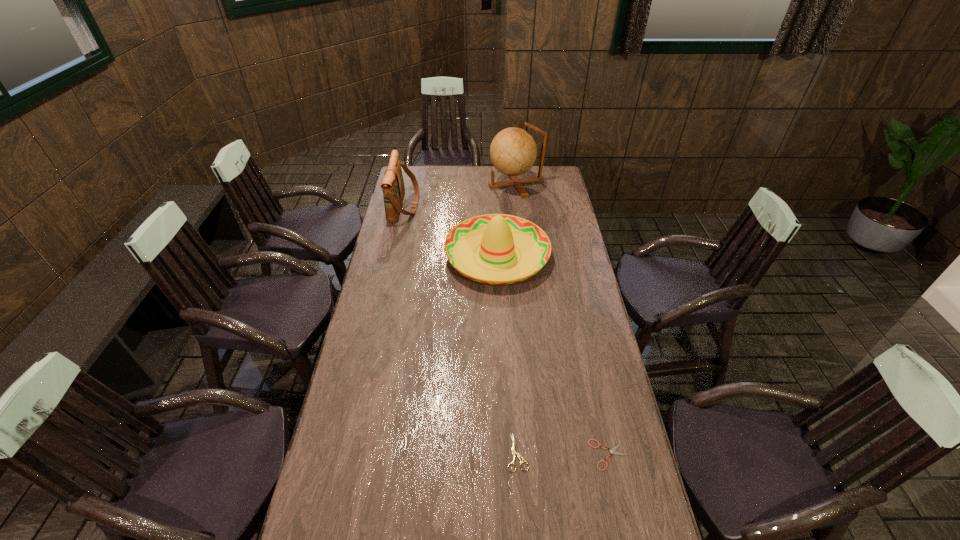
Locate an element on the screen. Image resolution: width=960 pixels, height=540 pixels. object that is at the far left corner is located at coordinates (392, 184).

Identify the location of object located in the far right corner section of the desktop. (513, 151).

The width and height of the screenshot is (960, 540). What are the coordinates of `vacant space at the far edge of the desktop` in the screenshot? It's located at (445, 171).

At what (x,y) coordinates should I click in order to perform the action: click on free space at the left edge of the desktop. Please return your answer as a coordinate pair (x, y). Image resolution: width=960 pixels, height=540 pixels. Looking at the image, I should click on (381, 425).

Locate an element on the screen. The width and height of the screenshot is (960, 540). free location at the right edge of the desktop is located at coordinates (551, 236).

You are a GUI agent. You are given a task and a screenshot of the screen. Output one action in this format:
    pyautogui.click(x=<x>, y=<y>)
    Task: Click on the vacant space at the far left corner of the desktop
    The height and width of the screenshot is (540, 960).
    Given the screenshot: What is the action you would take?
    pyautogui.click(x=407, y=182)

You are a GUI agent. You are given a task and a screenshot of the screen. Output one action in this format:
    pyautogui.click(x=<x>, y=<y>)
    Task: Click on the free space at the far right corner of the desktop
    Image resolution: width=960 pixels, height=540 pixels.
    Given the screenshot: What is the action you would take?
    pyautogui.click(x=537, y=172)

Locate an element on the screen. The image size is (960, 540). empty location between the left shears and the globe is located at coordinates (516, 318).

You are a GUI agent. You are given a task and a screenshot of the screen. Output one action in this format:
    pyautogui.click(x=<x>, y=<y>)
    Task: Click on the vacant space that is in between the right shears and the taller shears
    The width and height of the screenshot is (960, 540).
    Given the screenshot: What is the action you would take?
    pyautogui.click(x=563, y=454)

I want to click on unoccupied position between the shortest object and the taller shears, so click(563, 454).